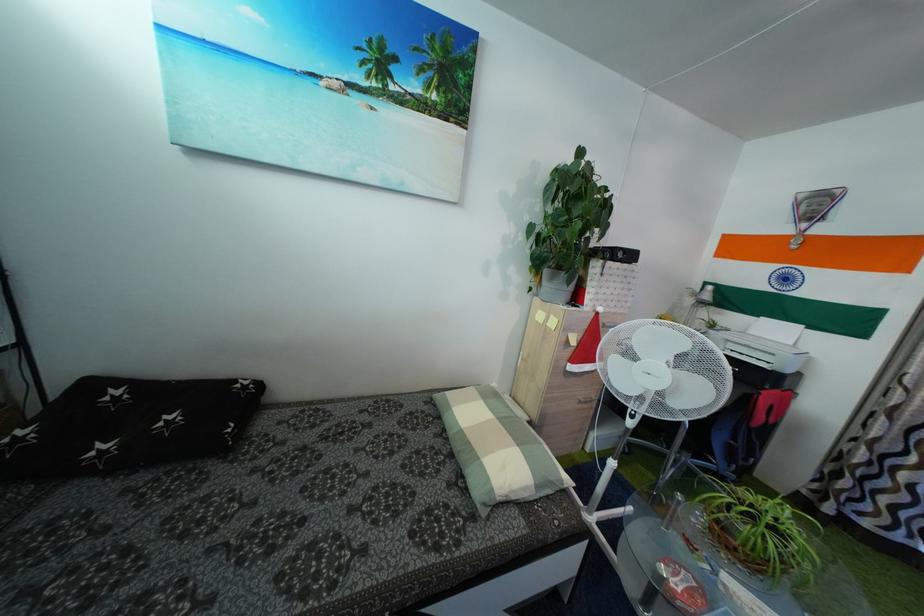
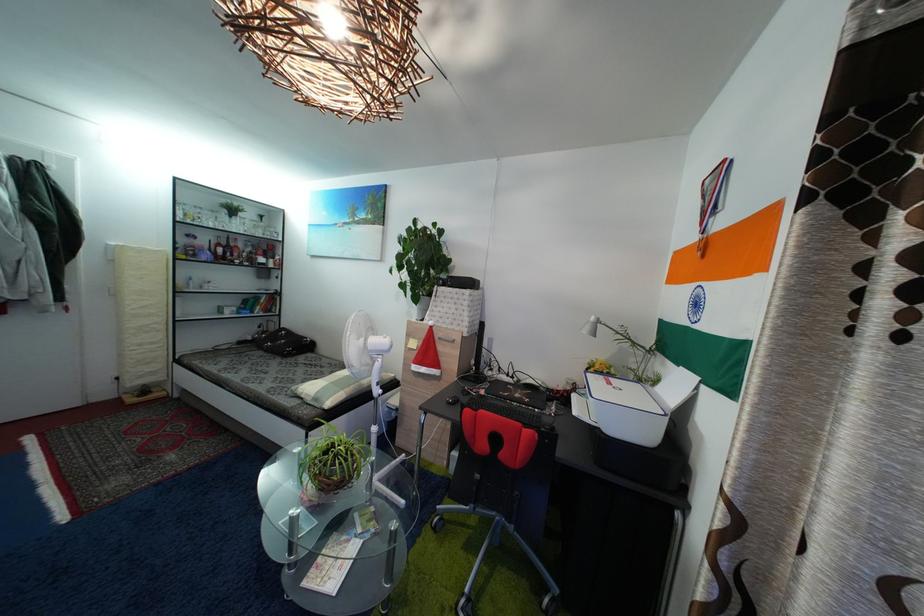
The point at [541,501] is marked in the first image. Where is the corresponding point in the second image?

(318, 407)